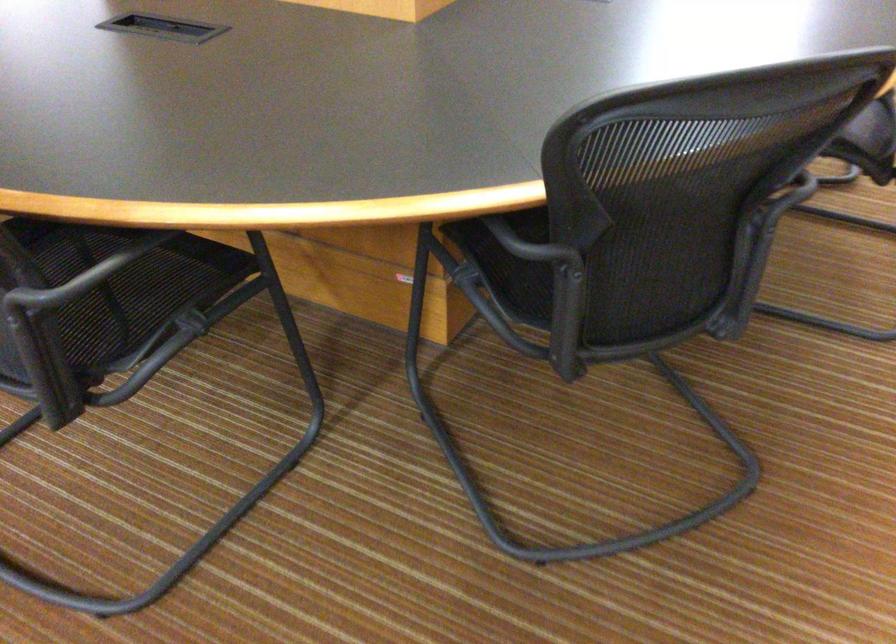
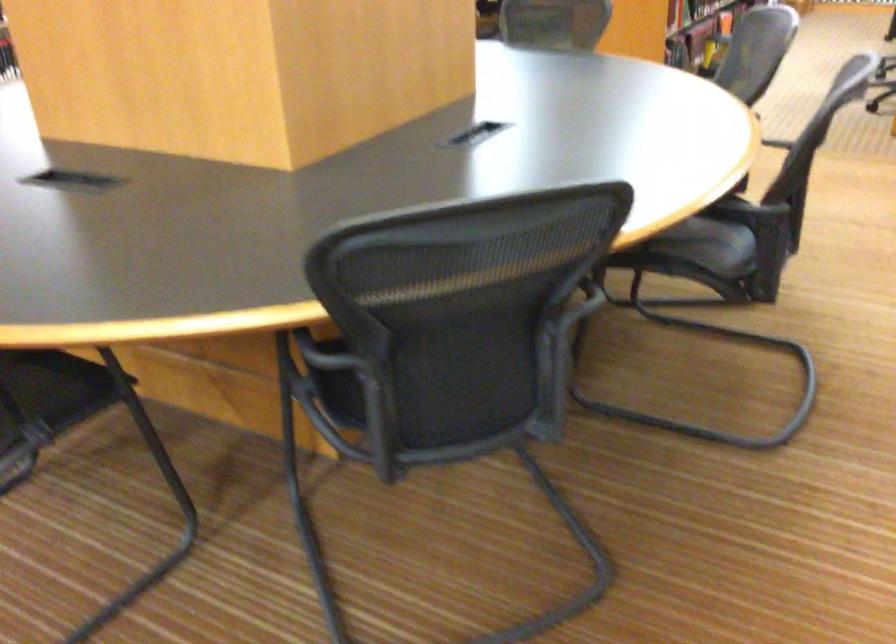
Question: What movement of the cameraman would produce the second image?

Choices:
 (A) Left
 (B) Right
 (C) Forward
 (D) Backward

Answer: (B)